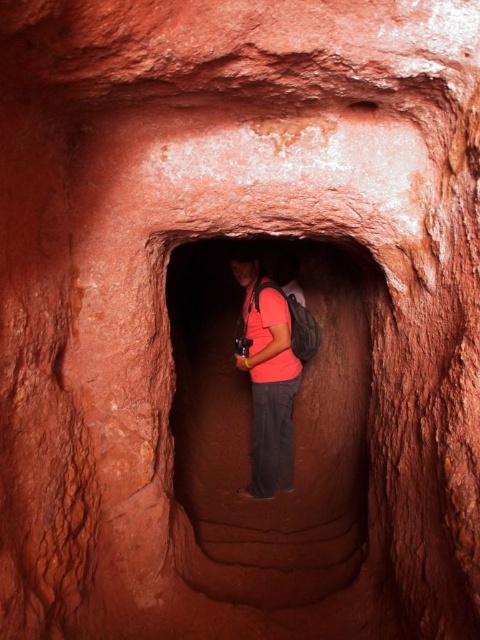
You are a photographer preparing to take a wide shot of the cave. You notice the matte red rock at center and the matte pink shirt at center. Which object should you focus on to ensure the larger subject is captured clearly?

You should focus on the matte red rock at center because it is larger than the matte pink shirt at center, ensuring the larger subject is captured clearly.

You are a photographer trying to capture the matte red rock at center and the matte pink shirt at center in the same frame. Based on their positions, which object should you focus on first to ensure both are in sharp focus?

The matte red rock at center is closer to the viewer than the matte pink shirt at center, so you should focus on the matte red rock at center first to ensure both are in sharp focus.

You are a photographer preparing to take a picture of the matte red rock at center and the matte pink shirt at center in the cave. Your camera has a minimum focusing distance of 60 centimeters. Will you need to move closer or farther away to ensure both subjects are in focus?

The distance between the matte red rock at center and the matte pink shirt at center is 56.86 centimeters. Since the minimum focusing distance is 60 centimeters, you need to move farther away from the subjects so that the total distance is at least 60 centimeters to ensure both are in focus.